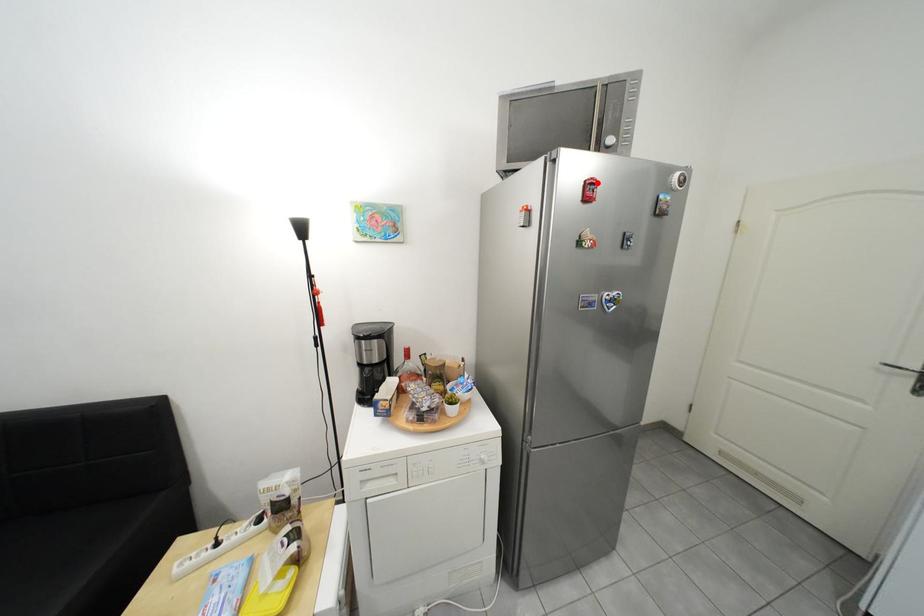
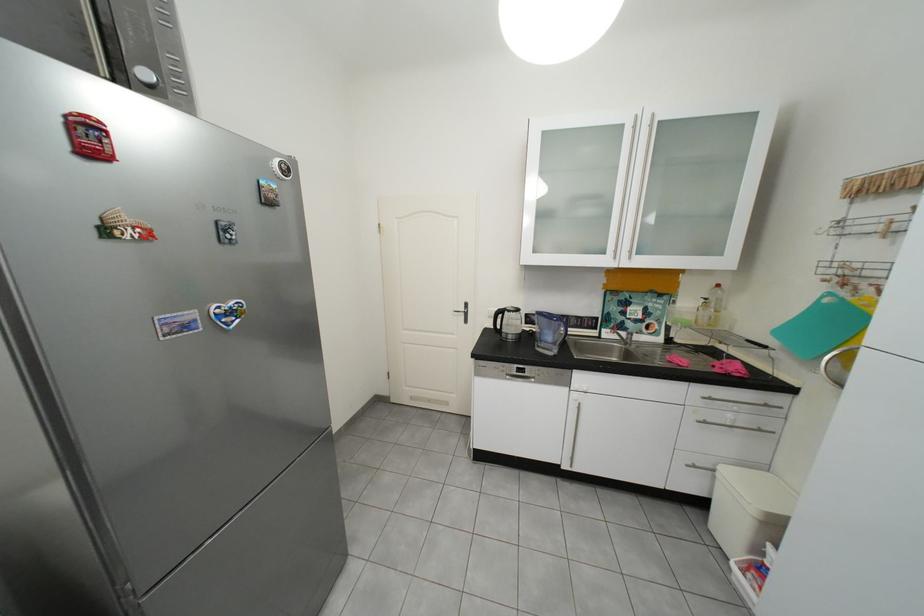
Question: I am providing you with two images of the same scene from different viewpoints. A red point is marked on the first image. At the location where the point appears in image 1, is it still visible in image 2?

Choices:
 (A) Yes
 (B) No

Answer: (A)